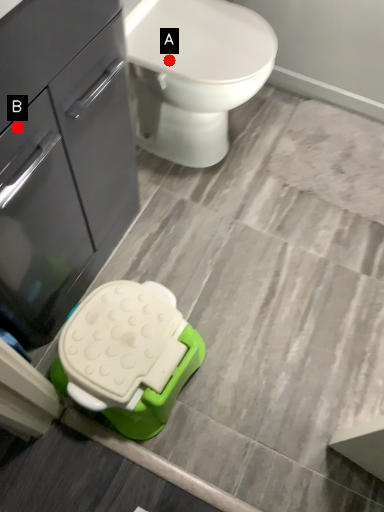
Question: Two points are circled on the image, labeled by A and B beside each circle. Which point is farther from the camera taking this photo?

Choices:
 (A) A is further
 (B) B is further

Answer: (A)